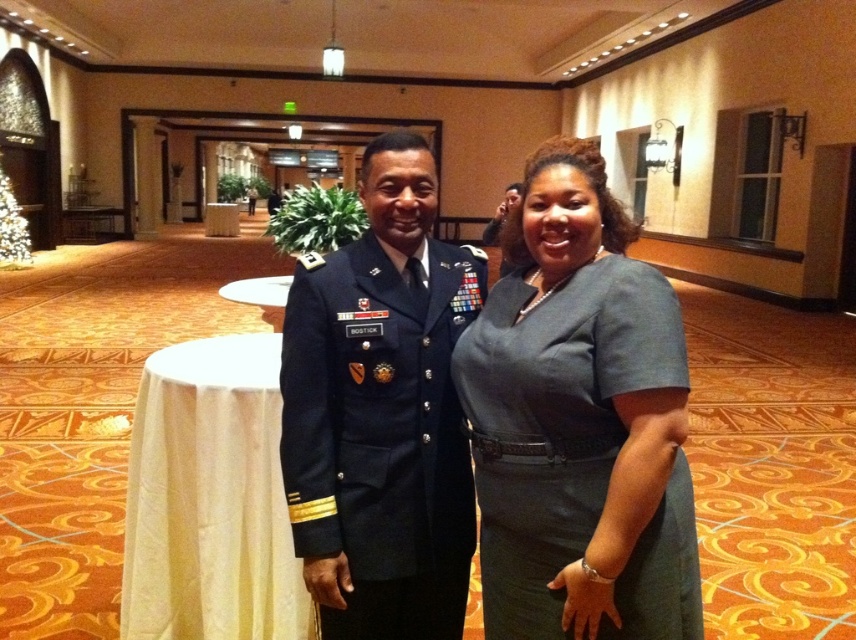
Does navy blue fabric uniform at center have a lesser height compared to white cloth at left?

No.

Is navy blue fabric uniform at center further to camera compared to white cloth at left?

No, navy blue fabric uniform at center is closer to the viewer.

Where is `navy blue fabric uniform at center`? Image resolution: width=856 pixels, height=640 pixels. navy blue fabric uniform at center is located at coordinates (381, 435).

You are a GUI agent. You are given a task and a screenshot of the screen. Output one action in this format:
    pyautogui.click(x=<x>, y=<y>)
    Task: Click on the navy blue fabric uniform at center
    
    Given the screenshot: What is the action you would take?
    pyautogui.click(x=381, y=435)

Can you confirm if matte gray dress at center is taller than navy blue fabric uniform at center?

Correct, matte gray dress at center is much taller as navy blue fabric uniform at center.

Between matte gray dress at center and navy blue fabric uniform at center, which one is positioned higher?

matte gray dress at center

Where is `matte gray dress at center`? Image resolution: width=856 pixels, height=640 pixels. matte gray dress at center is located at coordinates (580, 422).

Which is more to the right, matte gray dress at center or white cloth at left?

From the viewer's perspective, matte gray dress at center appears more on the right side.

Which is in front, point (577, 179) or point (140, 420)?

Point (577, 179) is more forward.

The width and height of the screenshot is (856, 640). What are the coordinates of `matte gray dress at center` in the screenshot? It's located at (580, 422).